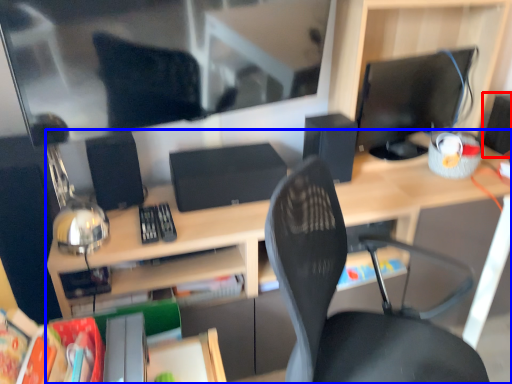
Question: Among these objects, which one is farthest to the camera, speaker (highlighted by a red box) or desk (highlighted by a blue box)?

Choices:
 (A) speaker
 (B) desk

Answer: (A)